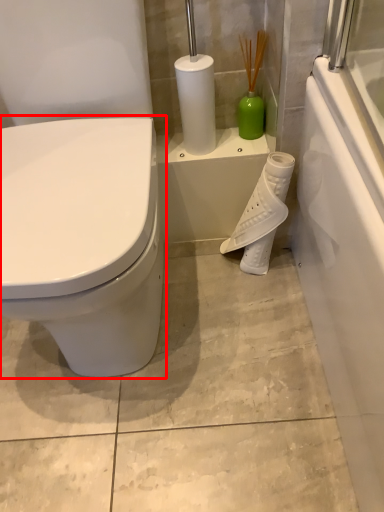
Question: From the image's perspective, what is the correct spatial relationship of toilet (annotated by the red box) in relation to toilet paper?

Choices:
 (A) below
 (B) above

Answer: (B)